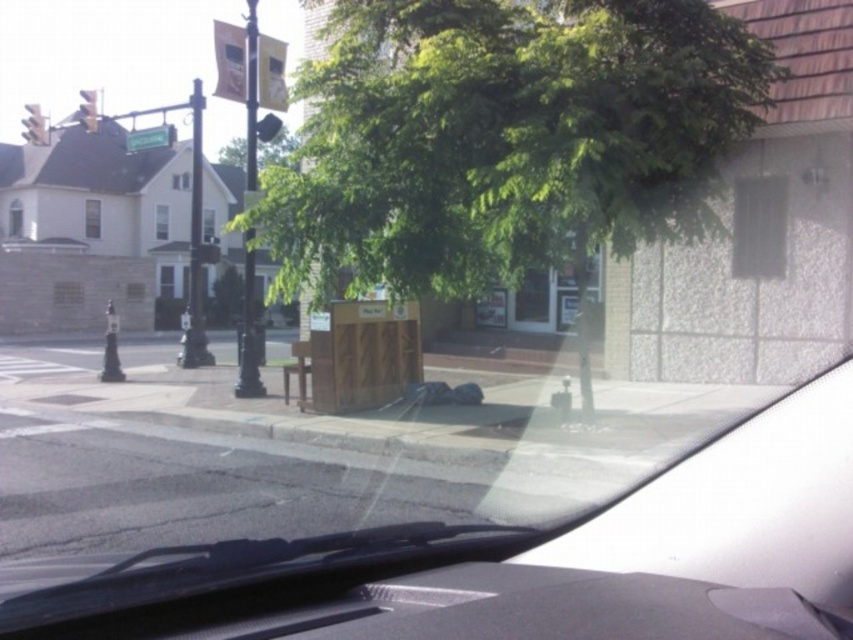
Who is positioned more to the right, metallic traffic light at upper left or yellow matte traffic light at upper left?

Positioned to the right is yellow matte traffic light at upper left.

Who is lower down, metallic traffic light at upper left or yellow matte traffic light at upper left?

metallic traffic light at upper left

Locate an element on the screen. metallic traffic light at upper left is located at coordinates (35, 125).

Describe the element at coordinates (88, 109) in the screenshot. I see `yellow matte traffic light at upper left` at that location.

Is yellow matte traffic light at upper left taller than metallic yellow traffic light at upper center?

Correct, yellow matte traffic light at upper left is much taller as metallic yellow traffic light at upper center.

The width and height of the screenshot is (853, 640). What do you see at coordinates (88, 109) in the screenshot?
I see `yellow matte traffic light at upper left` at bounding box center [88, 109].

Find the location of a particular element. The image size is (853, 640). yellow matte traffic light at upper left is located at coordinates (88, 109).

Where is `white matte car at center`? white matte car at center is located at coordinates (527, 561).

Between point (735, 444) and point (86, 106), which one is positioned in front?

Point (735, 444)

You are a GUI agent. You are given a task and a screenshot of the screen. Output one action in this format:
    pyautogui.click(x=<x>, y=<y>)
    Task: Click on the white matte car at center
    
    Given the screenshot: What is the action you would take?
    pyautogui.click(x=527, y=561)